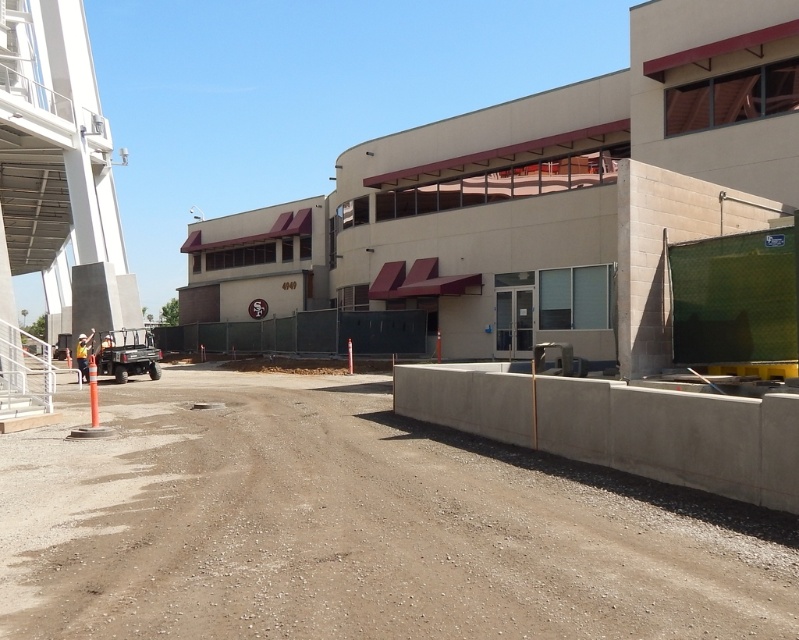
Does black matte barrier at center have a smaller size compared to orange reflective vest at left?

No.

Which is below, black matte barrier at center or orange reflective vest at left?

Positioned lower is orange reflective vest at left.

Who is more distant from viewer, (249, 332) or (80, 344)?

Point (249, 332)

I want to click on black matte barrier at center, so click(304, 333).

Consider the image. Who is higher up, concrete wall at lower right or orange reflective vest at left?

concrete wall at lower right is above.

Does concrete wall at lower right lie behind orange reflective vest at left?

No, it is in front of orange reflective vest at left.

I want to click on concrete wall at lower right, so (618, 426).

This screenshot has width=799, height=640. I want to click on concrete wall at lower right, so [x=618, y=426].

Which of these two, concrete wall at lower right or black matte barrier at center, stands taller?

black matte barrier at center is taller.

Where is `concrete wall at lower right`? Image resolution: width=799 pixels, height=640 pixels. concrete wall at lower right is located at coordinates (618, 426).

At what (x,y) coordinates should I click in order to perform the action: click on concrete wall at lower right. Please return your answer as a coordinate pair (x, y). Looking at the image, I should click on (618, 426).